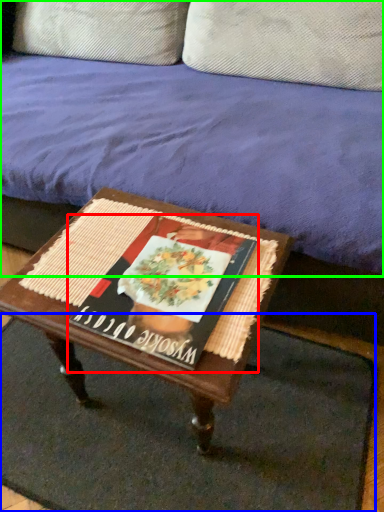
Question: Which object is the closest to the magazine (highlighted by a red box)? Choose among these: doormat (highlighted by a blue box) or studio couch (highlighted by a green box).

Choices:
 (A) doormat
 (B) studio couch

Answer: (B)